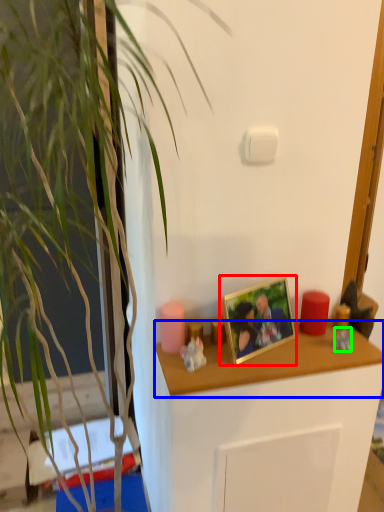
Question: Estimate the real-world distances between objects in this image. Which object is closer to picture frame (highlighted by a red box), desk (highlighted by a blue box) or toy (highlighted by a green box)?

Choices:
 (A) desk
 (B) toy

Answer: (A)